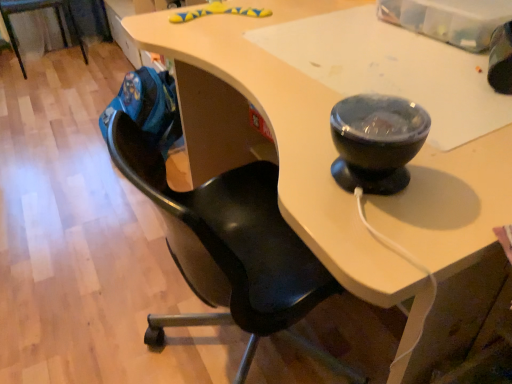
Question: Is the position of black leather chair at left, which is counted as the 1th chair, starting from the back, more distant than that of black matte chair at center, which is counted as the 1th chair, starting from the bottom?

Choices:
 (A) no
 (B) yes

Answer: (B)

Question: Is black leather chair at left, positioned as the first chair in left-to-right order, positioned far away from black matte chair at center, acting as the second chair starting from the top?

Choices:
 (A) no
 (B) yes

Answer: (B)

Question: Could you tell me if black leather chair at left, which is the first chair from top to bottom, is turned towards black matte chair at center, which is counted as the 2th chair, starting from the back?

Choices:
 (A) no
 (B) yes

Answer: (B)

Question: Is black leather chair at left, marked as the 2th chair in a bottom-to-top arrangement, outside of black matte chair at center, which is counted as the first chair, starting from the front?

Choices:
 (A) yes
 (B) no

Answer: (A)

Question: Can you confirm if black leather chair at left, which is counted as the 1th chair, starting from the back, is wider than black matte chair at center, the 2th chair from the left?

Choices:
 (A) no
 (B) yes

Answer: (B)

Question: Considering the relative positions of black leather chair at left, which is the first chair from top to bottom, and black matte chair at center, acting as the second chair starting from the top, in the image provided, is black leather chair at left, which is the first chair from top to bottom, in front of black matte chair at center, acting as the second chair starting from the top,?

Choices:
 (A) no
 (B) yes

Answer: (A)

Question: Can you confirm if black matte chair at center, acting as the second chair starting from the top, is thinner than black leather chair at left, which is counted as the 1th chair, starting from the back?

Choices:
 (A) no
 (B) yes

Answer: (B)

Question: Does black matte chair at center, which is counted as the 1th chair, starting from the right, lie behind black leather chair at left, which is the first chair from top to bottom?

Choices:
 (A) no
 (B) yes

Answer: (A)

Question: Would you consider black matte chair at center, which is counted as the 2th chair, starting from the back, to be distant from black leather chair at left, the second chair viewed from the right?

Choices:
 (A) yes
 (B) no

Answer: (A)

Question: Is black matte chair at center, which is counted as the 2th chair, starting from the back, looking in the opposite direction of black leather chair at left, marked as the 2th chair in a bottom-to-top arrangement?

Choices:
 (A) no
 (B) yes

Answer: (A)

Question: Is black matte chair at center, which is counted as the 1th chair, starting from the right, next to black leather chair at left, positioned as the first chair in left-to-right order, and touching it?

Choices:
 (A) yes
 (B) no

Answer: (B)

Question: From the image's perspective, is black matte chair at center, which is counted as the first chair, starting from the front, under black leather chair at left, the second chair viewed from the right?

Choices:
 (A) no
 (B) yes

Answer: (B)

Question: Is point (358, 382) closer or farther from the camera than point (54, 8)?

Choices:
 (A) closer
 (B) farther

Answer: (A)